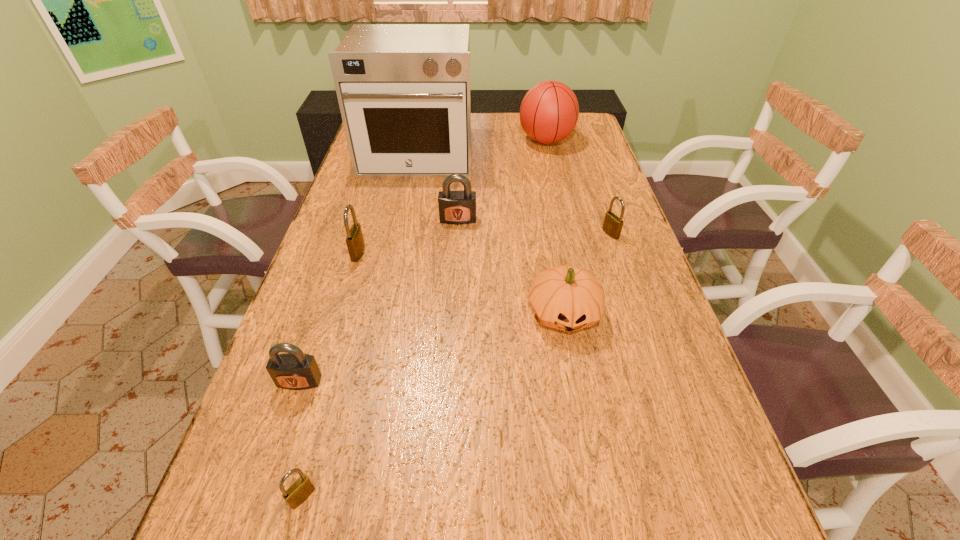
Image resolution: width=960 pixels, height=540 pixels. What are the coordinates of `the second nearest object` in the screenshot? It's located at (294, 370).

The height and width of the screenshot is (540, 960). I want to click on the second nearest padlock, so click(x=294, y=370).

Identify the location of the shortest padlock. tap(301, 489).

Where is `the shortest object`? The width and height of the screenshot is (960, 540). the shortest object is located at coordinates (301, 489).

The height and width of the screenshot is (540, 960). Identify the location of free region located on the front panel of the toaster oven. (406, 211).

This screenshot has width=960, height=540. What are the coordinates of `vacant region located 0.060m on the right of the basketball` in the screenshot? It's located at (590, 141).

Locate an element on the screen. free space located on the back of the third nearest padlock is located at coordinates (380, 179).

The image size is (960, 540). Identify the location of vacant space located 0.080m on the front of the farthest padlock near the keyhole. click(x=457, y=243).

Identify the location of vacant space located on the side of the gourd with the carved face. (597, 497).

At what (x,y) coordinates should I click in order to perform the action: click on vacant space positioned 0.150m on the back of the second biggest brass padlock. Please return your answer as a coordinate pair (x, y). This screenshot has width=960, height=540. Looking at the image, I should click on (598, 198).